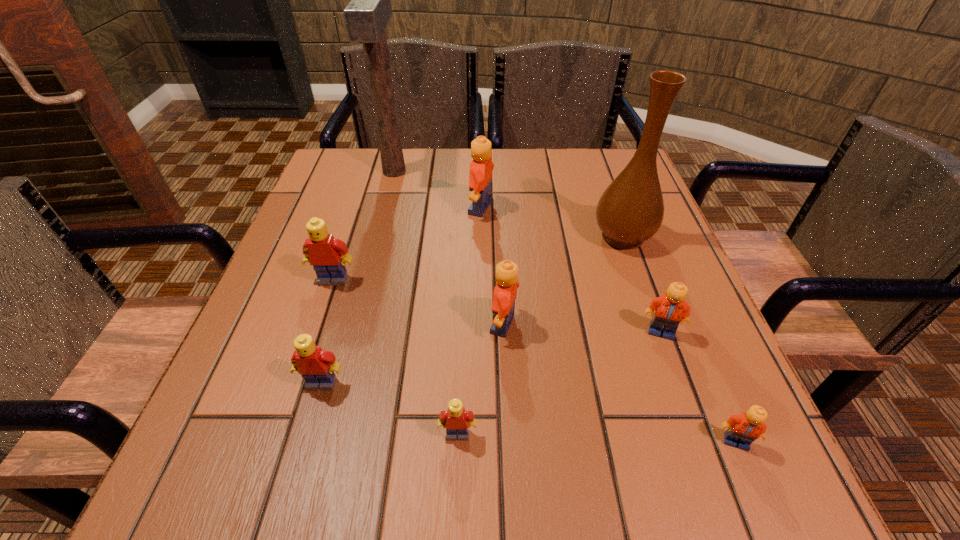
I want to click on vacant point located on the front-facing side of the second biggest orange Lego, so click(x=373, y=325).

Image resolution: width=960 pixels, height=540 pixels. Identify the location of vacant region located on the front-facing side of the second biggest orange Lego. (346, 325).

The width and height of the screenshot is (960, 540). In order to click on free location located on the front-facing side of the second farthest Lego in this screenshot , I will do `click(287, 420)`.

Find the location of a particular element. free space located 0.270m on the front-facing side of the second smallest orange Lego is located at coordinates point(725,507).

In order to click on vacant space located 0.160m on the front-facing side of the second smallest yellow Lego in this screenshot , I will do `click(289, 497)`.

Where is `vacant area situated on the front-facing side of the smallest orange Lego`? vacant area situated on the front-facing side of the smallest orange Lego is located at coordinates (761, 504).

Find the location of a particular element. This screenshot has height=540, width=960. vacant space situated on the front-facing side of the nearest yellow Lego is located at coordinates (456, 476).

The image size is (960, 540). What are the coordinates of `mallet positioned at the far edge` in the screenshot? It's located at (366, 16).

What are the coordinates of `Lego located in the far edge section of the desktop` in the screenshot? It's located at (480, 176).

Locate an element on the screen. The image size is (960, 540). object positioned at the near edge is located at coordinates (743, 429).